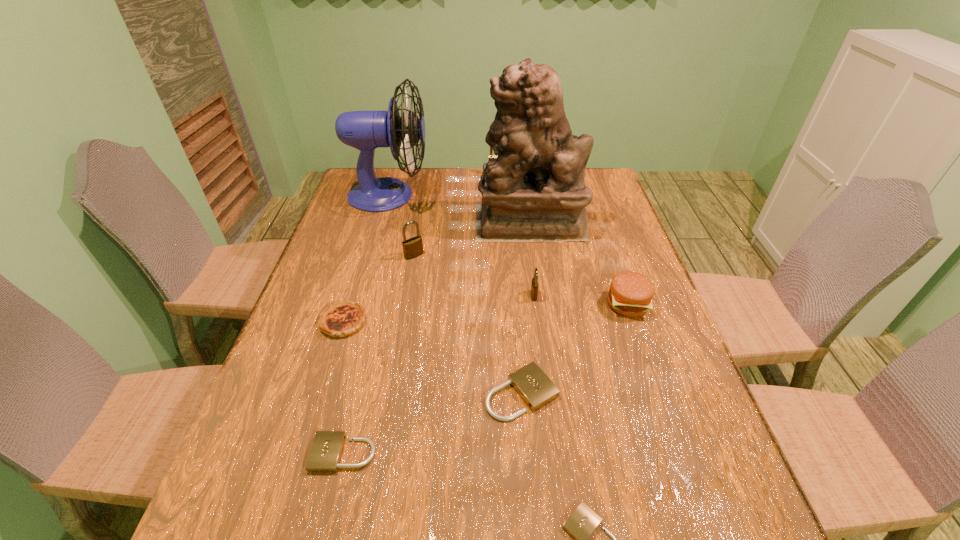
Locate an element on the screen. This screenshot has width=960, height=540. the tallest object is located at coordinates (535, 190).

Locate an element on the screen. This screenshot has height=540, width=960. fan is located at coordinates (364, 130).

Identify the location of the farthest padlock. The width and height of the screenshot is (960, 540). (491, 155).

Locate an element on the screen. the second brass padlock from right to left is located at coordinates (491, 155).

The width and height of the screenshot is (960, 540). In order to click on the seventh nearest object in this screenshot , I will do `click(413, 247)`.

This screenshot has width=960, height=540. Find the location of `the second farthest brass padlock`. the second farthest brass padlock is located at coordinates (413, 247).

The image size is (960, 540). What are the coordinates of `the smallest brass padlock` in the screenshot? It's located at (534, 286).

Image resolution: width=960 pixels, height=540 pixels. I want to click on the third farthest padlock, so pyautogui.click(x=534, y=286).

Find the location of `hamburger`. hamburger is located at coordinates (630, 294).

Where is `quiche`? quiche is located at coordinates (339, 319).